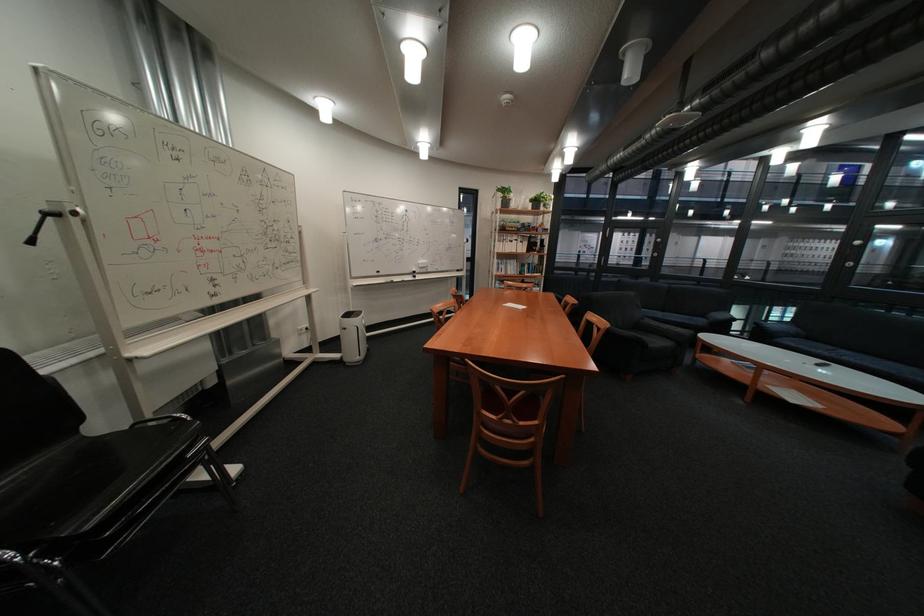
This screenshot has width=924, height=616. Find the location of `black adjustment knob`. black adjustment knob is located at coordinates (41, 225).